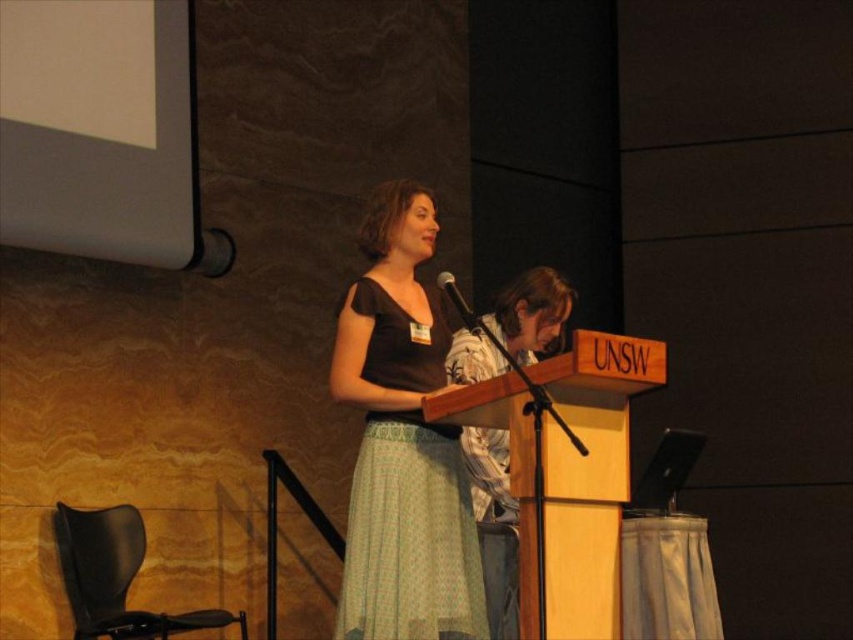
Does matte black dress at center have a greater width compared to patterned fabric shirt at center?

Correct, the width of matte black dress at center exceeds that of patterned fabric shirt at center.

Does matte black dress at center appear on the right side of patterned fabric shirt at center?

No, matte black dress at center is not to the right of patterned fabric shirt at center.

What are the coordinates of `matte black dress at center` in the screenshot? It's located at (402, 442).

The width and height of the screenshot is (853, 640). What are the coordinates of `matte black dress at center` in the screenshot? It's located at (402, 442).

Is point (375, 237) closer to viewer compared to point (469, 310)?

Yes, it is in front of point (469, 310).

Is matte black dress at center shorter than metallic silver microphone at center?

No, matte black dress at center is not shorter than metallic silver microphone at center.

What do you see at coordinates (402, 442) in the screenshot? I see `matte black dress at center` at bounding box center [402, 442].

Where is `matte black dress at center`? The width and height of the screenshot is (853, 640). matte black dress at center is located at coordinates (402, 442).

Looking at this image, does patterned fabric shirt at center have a lesser height compared to metallic silver microphone at center?

In fact, patterned fabric shirt at center may be taller than metallic silver microphone at center.

Is patterned fabric shirt at center positioned at the back of metallic silver microphone at center?

Yes, patterned fabric shirt at center is behind metallic silver microphone at center.

Is point (486, 552) positioned behind point (444, 280)?

Yes, point (486, 552) is farther from viewer.

Identify the location of patterned fabric shirt at center. This screenshot has height=640, width=853. (514, 330).